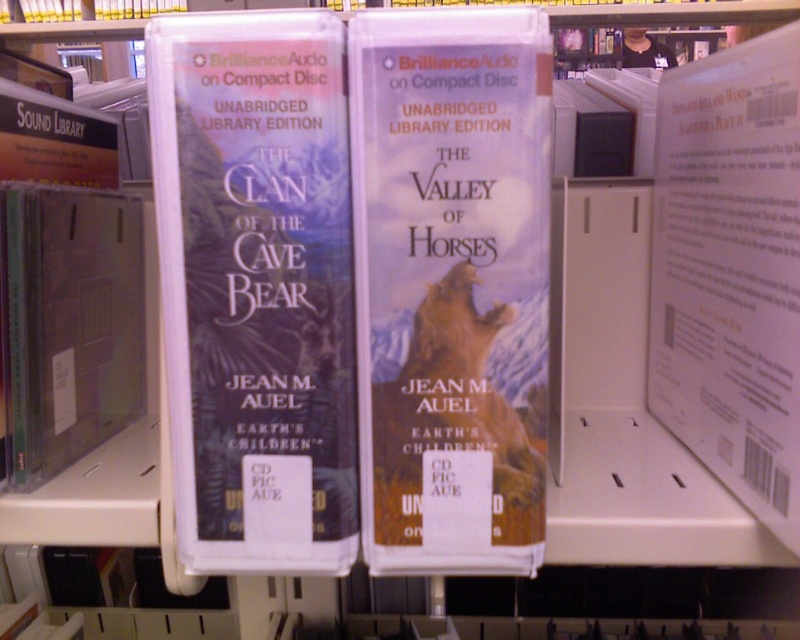
Question: Is matte paper cover at center above matte plastic book at center?

Choices:
 (A) no
 (B) yes

Answer: (A)

Question: Which object is farther from the camera taking this photo?

Choices:
 (A) matte paper cover at center
 (B) matte plastic book at center

Answer: (B)

Question: Is matte plastic book at center positioned at the back of white paper at upper right?

Choices:
 (A) yes
 (B) no

Answer: (B)

Question: Estimate the real-world distances between objects in this image. Which object is farther from the matte plastic book at center?

Choices:
 (A) matte paper cover at center
 (B) white paper at upper right

Answer: (B)

Question: Can you confirm if matte paper cover at center is wider than matte plastic book at center?

Choices:
 (A) yes
 (B) no

Answer: (B)

Question: Which object is closer to the camera taking this photo?

Choices:
 (A) matte plastic book at center
 (B) matte paper cover at center
 (C) white paper at upper right

Answer: (B)